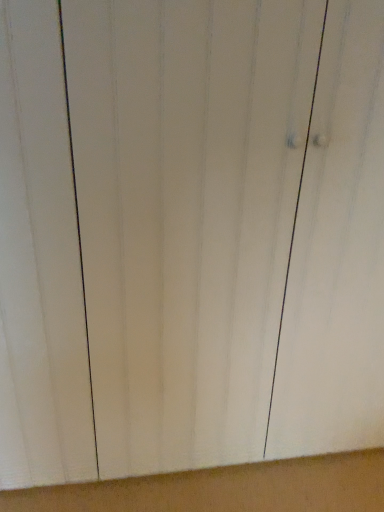
In order to face white matte plywood at bottom, should I rotate leftwards or rightwards?

Rotate right and turn 3.034 degrees.

The width and height of the screenshot is (384, 512). Identify the location of white matte plywood at bottom. (226, 488).

Describe the element at coordinates (226, 488) in the screenshot. I see `white matte plywood at bottom` at that location.

Image resolution: width=384 pixels, height=512 pixels. In order to click on white matte plywood at bottom in this screenshot , I will do `click(226, 488)`.